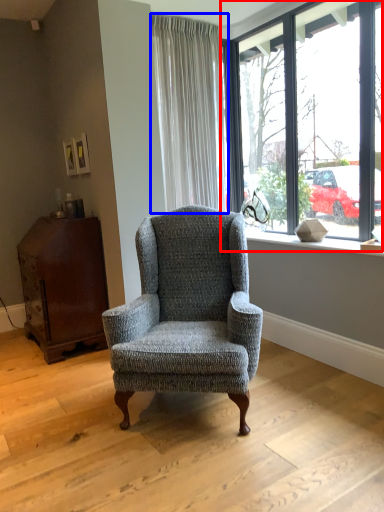
Question: Which point is further to the camera, window (highlighted by a red box) or curtain (highlighted by a blue box)?

Choices:
 (A) window
 (B) curtain

Answer: (B)